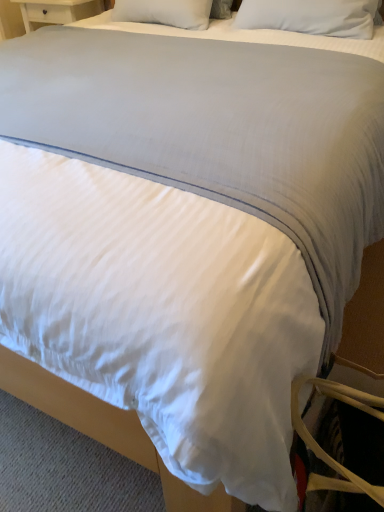
At what (x,y) coordinates should I click in order to perform the action: click on white soft pillow at upper center, which ranks as the 1th pillow in right-to-left order. Please return your answer as a coordinate pair (x, y). The image size is (384, 512). Looking at the image, I should click on (310, 16).

You are a GUI agent. You are given a task and a screenshot of the screen. Output one action in this format:
    pyautogui.click(x=<x>, y=<y>)
    Task: Click on the tan leather swivel chair at lower right
    This screenshot has height=512, width=384.
    Given the screenshot: What is the action you would take?
    pyautogui.click(x=322, y=449)

In order to click on white soft pillow at upper center, which ranks as the 1th pillow in right-to-left order in this screenshot , I will do `click(310, 16)`.

Between white soft pillow at upper center, the second pillow positioned from the right, and white soft pillow at upper center, which ranks as the 1th pillow in right-to-left order, which one has less height?

With less height is white soft pillow at upper center, the second pillow positioned from the right.

Is white soft pillow at upper center, the second pillow viewed from the left, completely or partially inside white soft pillow at upper center, the second pillow positioned from the right?

No, white soft pillow at upper center, the second pillow viewed from the left, is located outside of white soft pillow at upper center, the second pillow positioned from the right.

Consider the image. Is white soft pillow at upper center, the second pillow positioned from the right, looking in the opposite direction of white soft pillow at upper center, which ranks as the 1th pillow in right-to-left order?

No, white soft pillow at upper center, the second pillow positioned from the right,'s orientation is not away from white soft pillow at upper center, which ranks as the 1th pillow in right-to-left order.

From a real-world perspective, is white soft pillow at upper center, placed as the first pillow when sorted from left to right, physically below white soft pillow at upper center, which ranks as the 1th pillow in right-to-left order?

Yes, from a real-world perspective, white soft pillow at upper center, placed as the first pillow when sorted from left to right, is beneath white soft pillow at upper center, which ranks as the 1th pillow in right-to-left order.

Considering their positions, is tan leather swivel chair at lower right located in front of or behind white soft pillow at upper center, placed as the first pillow when sorted from left to right?

tan leather swivel chair at lower right is in front of white soft pillow at upper center, placed as the first pillow when sorted from left to right.

Find the location of `swivel chair below the white soft pillow at upper center, the second pillow positioned from the right (from a real-world perspective)`. swivel chair below the white soft pillow at upper center, the second pillow positioned from the right (from a real-world perspective) is located at coordinates (322, 449).

Is there a large distance between tan leather swivel chair at lower right and white soft pillow at upper center, the second pillow positioned from the right?

tan leather swivel chair at lower right is far away from white soft pillow at upper center, the second pillow positioned from the right.

Is tan leather swivel chair at lower right outside of white soft pillow at upper center, placed as the first pillow when sorted from left to right?

tan leather swivel chair at lower right is positioned outside white soft pillow at upper center, placed as the first pillow when sorted from left to right.

Is white soft pillow at upper center, which ranks as the 1th pillow in right-to-left order, next to tan leather swivel chair at lower right and touching it?

No, white soft pillow at upper center, which ranks as the 1th pillow in right-to-left order, is not touching tan leather swivel chair at lower right.

Which point is more forward, (x=321, y=13) or (x=324, y=380)?

The point (x=324, y=380) is in front.

From a real-world perspective, which is physically below, white soft pillow at upper center, which ranks as the 1th pillow in right-to-left order, or tan leather swivel chair at lower right?

In real-world perspective, tan leather swivel chair at lower right is lower.

Find the location of `the 2nd pillow positioned above the tan leather swivel chair at lower right (from a real-world perspective)`. the 2nd pillow positioned above the tan leather swivel chair at lower right (from a real-world perspective) is located at coordinates (x=310, y=16).

Locate an element on the screen. swivel chair directly beneath the white soft pillow at upper center, the second pillow viewed from the left (from a real-world perspective) is located at coordinates coord(322,449).

Is tan leather swivel chair at lower right positioned beyond the bounds of white soft pillow at upper center, the second pillow viewed from the left?

Yes, tan leather swivel chair at lower right is not within white soft pillow at upper center, the second pillow viewed from the left.

In the scene shown: From a real-world perspective, is tan leather swivel chair at lower right below white soft pillow at upper center, the second pillow viewed from the left?

Yes, from a real-world perspective, tan leather swivel chair at lower right is beneath white soft pillow at upper center, the second pillow viewed from the left.

Considering the relative positions of tan leather swivel chair at lower right and white soft pillow at upper center, which ranks as the 1th pillow in right-to-left order, in the image provided, is tan leather swivel chair at lower right to the left or to the right of white soft pillow at upper center, which ranks as the 1th pillow in right-to-left order,?

In the image, tan leather swivel chair at lower right appears on the left side of white soft pillow at upper center, which ranks as the 1th pillow in right-to-left order.

Does white soft pillow at upper center, the second pillow viewed from the left, come behind white soft pillow at upper center, the second pillow positioned from the right?

No, white soft pillow at upper center, the second pillow viewed from the left, is closer to the viewer.

Is white soft pillow at upper center, which ranks as the 1th pillow in right-to-left order, wider or thinner than white soft pillow at upper center, the second pillow positioned from the right?

In the image, white soft pillow at upper center, which ranks as the 1th pillow in right-to-left order, appears to be more narrow than white soft pillow at upper center, the second pillow positioned from the right.

Who is shorter, white soft pillow at upper center, the second pillow viewed from the left, or white soft pillow at upper center, placed as the first pillow when sorted from left to right?

Standing shorter between the two is white soft pillow at upper center, placed as the first pillow when sorted from left to right.

Can you confirm if white soft pillow at upper center, which ranks as the 1th pillow in right-to-left order, is smaller than white soft pillow at upper center, the second pillow positioned from the right?

Actually, white soft pillow at upper center, which ranks as the 1th pillow in right-to-left order, might be larger than white soft pillow at upper center, the second pillow positioned from the right.

From a real-world perspective, is white soft pillow at upper center, placed as the first pillow when sorted from left to right, located beneath tan leather swivel chair at lower right?

No, from a real-world perspective, white soft pillow at upper center, placed as the first pillow when sorted from left to right, is not below tan leather swivel chair at lower right.

Is point (177, 9) closer to camera compared to point (381, 418)?

No, it is not.

I want to click on swivel chair located on the right of white soft pillow at upper center, the second pillow positioned from the right, so coord(322,449).

Which object is closer to the camera taking this photo, white soft pillow at upper center, placed as the first pillow when sorted from left to right, or tan leather swivel chair at lower right?

Positioned in front is tan leather swivel chair at lower right.

Identify the location of pillow above the white soft pillow at upper center, the second pillow viewed from the left (from the image's perspective). The height and width of the screenshot is (512, 384). (165, 12).

Where is `swivel chair located underneath the white soft pillow at upper center, placed as the first pillow when sorted from left to right (from a real-world perspective)`? swivel chair located underneath the white soft pillow at upper center, placed as the first pillow when sorted from left to right (from a real-world perspective) is located at coordinates coord(322,449).

Looking at the image, which one is located closer to white soft pillow at upper center, which ranks as the 1th pillow in right-to-left order, tan leather swivel chair at lower right or white soft pillow at upper center, placed as the first pillow when sorted from left to right?

white soft pillow at upper center, placed as the first pillow when sorted from left to right, lies closer to white soft pillow at upper center, which ranks as the 1th pillow in right-to-left order, than the other object.

From the image, which object appears to be nearer to white soft pillow at upper center, the second pillow viewed from the left, white soft pillow at upper center, the second pillow positioned from the right, or tan leather swivel chair at lower right?

white soft pillow at upper center, the second pillow positioned from the right.

Which object lies nearer to the anchor point white soft pillow at upper center, the second pillow positioned from the right, white soft pillow at upper center, the second pillow viewed from the left, or tan leather swivel chair at lower right?

white soft pillow at upper center, the second pillow viewed from the left, lies closer to white soft pillow at upper center, the second pillow positioned from the right, than the other object.

In the scene shown: Which object lies further to the anchor point white soft pillow at upper center, placed as the first pillow when sorted from left to right, tan leather swivel chair at lower right or white soft pillow at upper center, the second pillow viewed from the left?

Based on the image, tan leather swivel chair at lower right appears to be further to white soft pillow at upper center, placed as the first pillow when sorted from left to right.

From the image, which object appears to be nearer to tan leather swivel chair at lower right, white soft pillow at upper center, the second pillow positioned from the right, or white soft pillow at upper center, the second pillow viewed from the left?

white soft pillow at upper center, the second pillow viewed from the left, is closer to tan leather swivel chair at lower right.

Looking at the image, which one is located further to tan leather swivel chair at lower right, white soft pillow at upper center, the second pillow viewed from the left, or white soft pillow at upper center, the second pillow positioned from the right?

white soft pillow at upper center, the second pillow positioned from the right, lies further to tan leather swivel chair at lower right than the other object.

The width and height of the screenshot is (384, 512). Find the location of `pillow between white soft pillow at upper center, the second pillow positioned from the right, and tan leather swivel chair at lower right, in the vertical direction`. pillow between white soft pillow at upper center, the second pillow positioned from the right, and tan leather swivel chair at lower right, in the vertical direction is located at coordinates (310, 16).